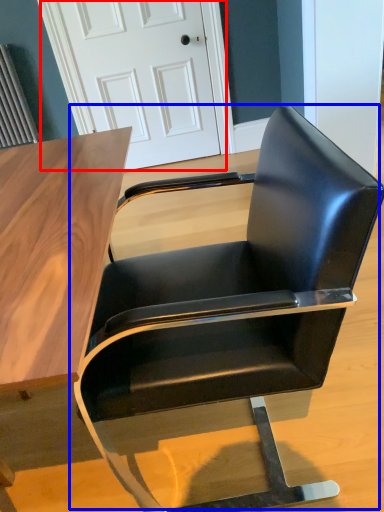
Question: Which point is closer to the camera, door (highlighted by a red box) or chair (highlighted by a blue box)?

Choices:
 (A) door
 (B) chair

Answer: (B)